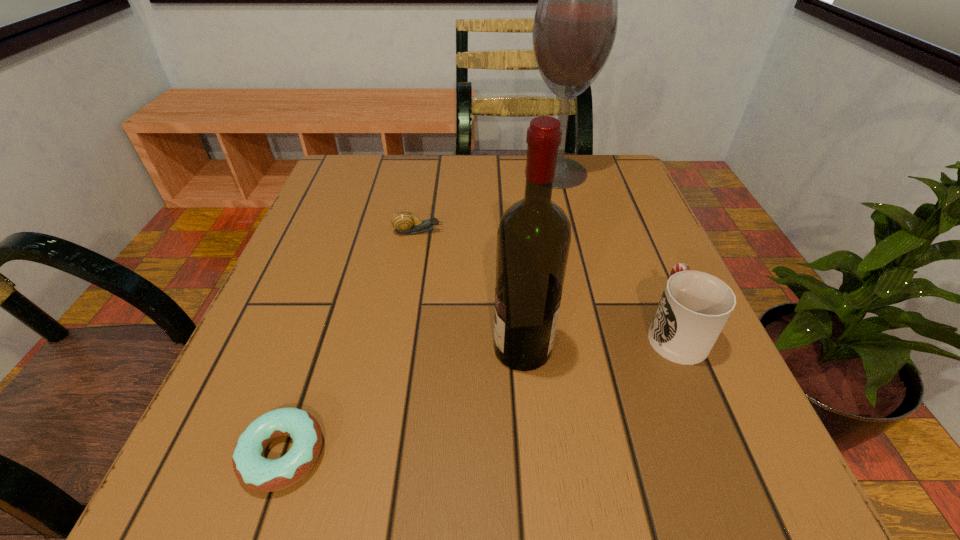
Where is `alcohol situated at the right edge`? This screenshot has height=540, width=960. alcohol situated at the right edge is located at coordinates (575, 24).

Locate an element on the screen. cup that is at the right edge is located at coordinates (695, 306).

I want to click on object that is at the near left corner, so click(252, 469).

Identify the location of object that is at the far right corner. (575, 24).

What are the coordinates of `free space at the far edge of the desktop` in the screenshot? It's located at (390, 205).

The image size is (960, 540). I want to click on free space at the near edge, so click(530, 516).

Find the location of a particular element. This screenshot has width=960, height=540. free space at the left edge of the desktop is located at coordinates click(x=337, y=264).

Locate an element on the screen. vacant region at the right edge of the desktop is located at coordinates (597, 272).

Find the location of a particular element. The height and width of the screenshot is (540, 960). vacant space at the far left corner of the desktop is located at coordinates (365, 184).

Locate an element on the screen. free space at the near left corner is located at coordinates (276, 446).